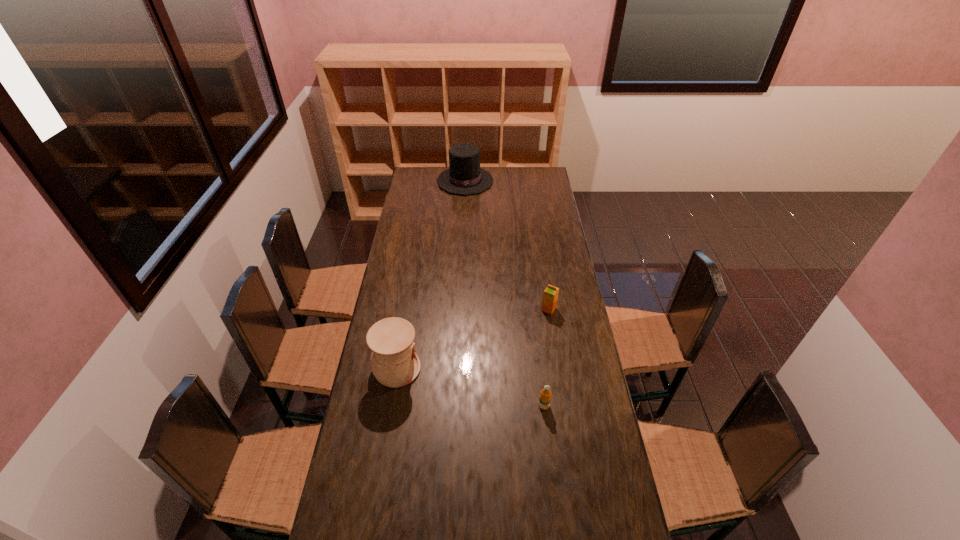
Locate an element on the screen. vacant area that lies between the dress hat and the second object from right to left is located at coordinates (505, 293).

Locate an element on the screen. The height and width of the screenshot is (540, 960). free space between the pottery and the dress hat is located at coordinates (431, 275).

Locate an element on the screen. This screenshot has width=960, height=540. vacant area between the rightmost object and the second object from right to left is located at coordinates (546, 357).

In order to click on vacant space that's between the third farthest object and the right orange juice in this screenshot , I will do `click(472, 339)`.

This screenshot has width=960, height=540. In order to click on unoccupied area between the third farthest object and the farthest object in this screenshot , I will do point(431,275).

You are a GUI agent. You are given a task and a screenshot of the screen. Output one action in this format:
    pyautogui.click(x=<x>, y=<y>)
    Task: Click on the blank region between the right orange juice and the dress hat
    The image size is (960, 540).
    Given the screenshot: What is the action you would take?
    pyautogui.click(x=507, y=245)

The height and width of the screenshot is (540, 960). In order to click on empty location between the nearest object and the third farthest object in this screenshot , I will do `click(470, 387)`.

This screenshot has width=960, height=540. What are the coordinates of `free point between the dress hat and the pottery` in the screenshot? It's located at (431, 275).

This screenshot has height=540, width=960. I want to click on the closest object relative to the dress hat, so click(550, 296).

Point out which object is positioned as the second nearest to the shorter orange juice. Please provide its 2D coordinates. Your answer should be formatted as a tuple, i.e. [(x, y)], where the tuple contains the x and y coordinates of a point satisfying the conditions above.

[(394, 362)]